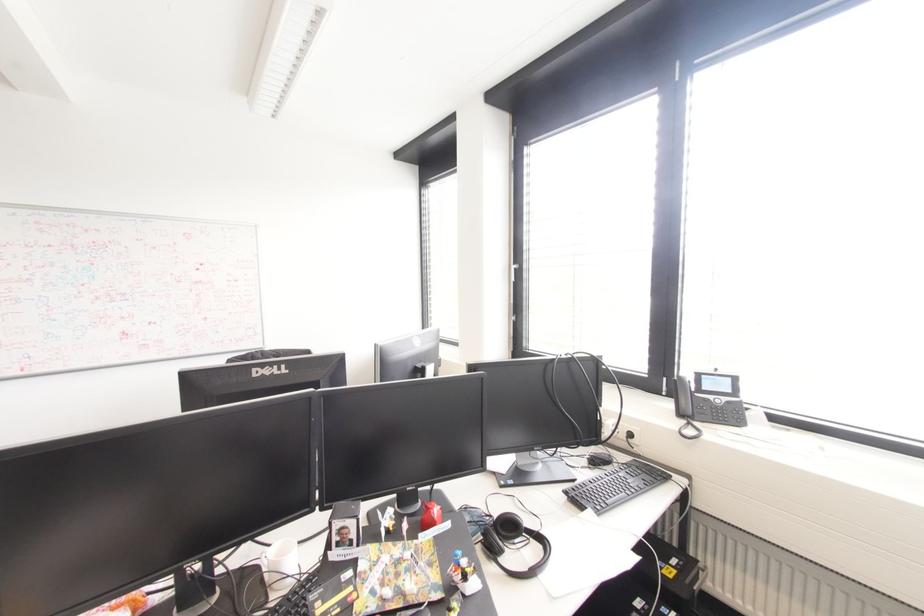
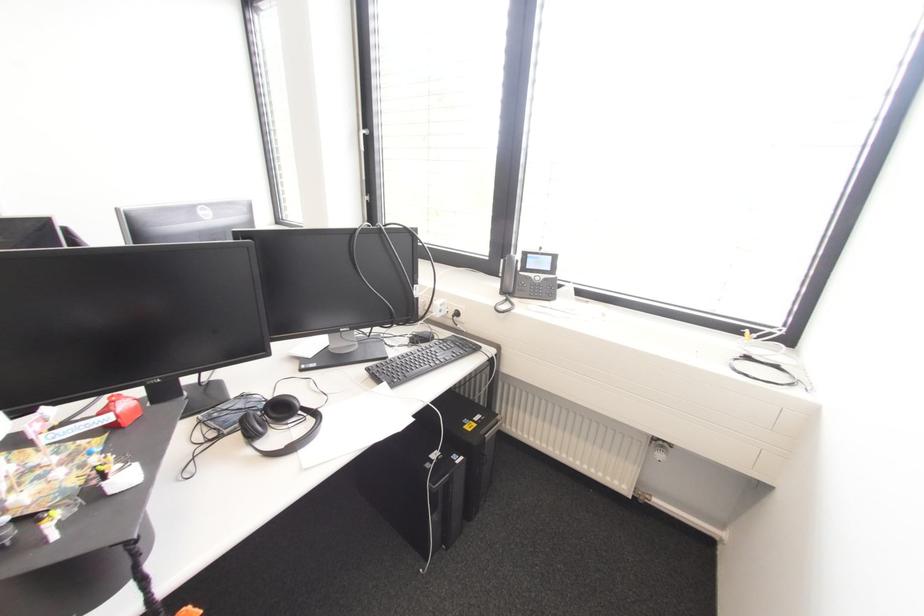
Question: In a continuous first-person perspective shot, in which direction is the camera moving?

Choices:
 (A) Left
 (B) Right
 (C) Forward
 (D) Backward

Answer: (B)